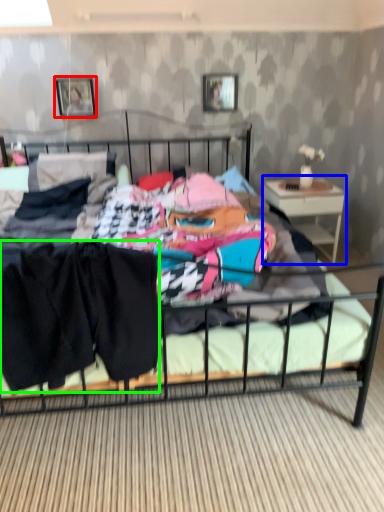
Question: Which object is the farthest from picture frame (highlighted by a red box)? Choose among these: nightstand (highlighted by a blue box) or clothing (highlighted by a green box).

Choices:
 (A) nightstand
 (B) clothing

Answer: (B)